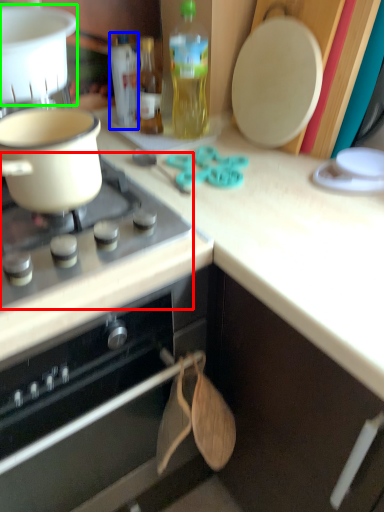
Question: Which object is positioned farthest from gas stove (highlighted by a red box)? Select from bottle (highlighted by a blue box) and kitchen appliance (highlighted by a green box).

Choices:
 (A) bottle
 (B) kitchen appliance

Answer: (A)